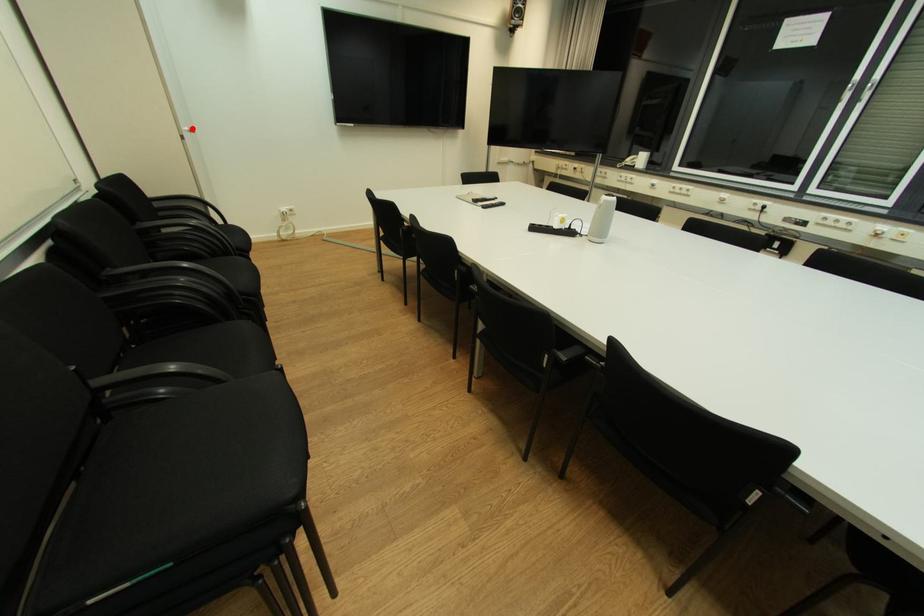
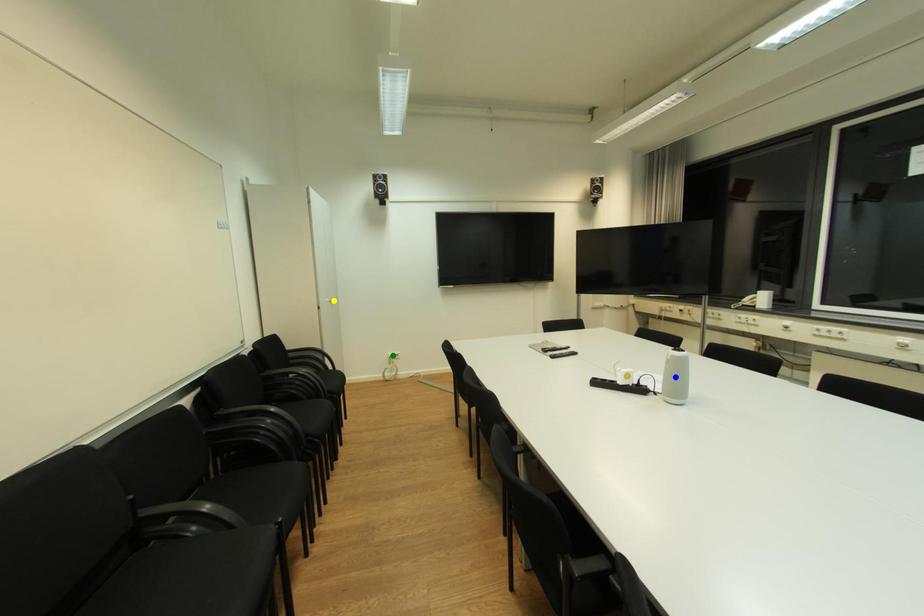
Question: I am providing you with two images of the same scene from different viewpoints. A red point is marked on the first image. You are given multiple points on the second image. Can you choose the point in image 2 that corresponds to the point in image 1?

Choices:
 (A) yellow point
 (B) green point
 (C) blue point

Answer: (A)